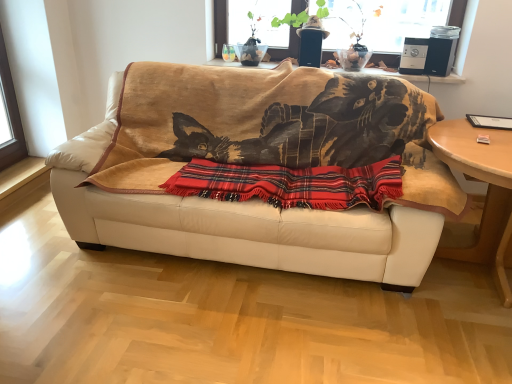
Describe the element at coordinates (420, 77) in the screenshot. This screenshot has height=384, width=512. I see `smooth glass window sill at upper center` at that location.

In the scene shown: In order to face red plaid blanket at center, should I rotate leftwards or rightwards?

You should look right and rotate roughly 3.926 degrees.

Image resolution: width=512 pixels, height=384 pixels. In order to click on smooth glass window sill at upper center in this screenshot , I will do `click(420, 77)`.

How much distance is there between red plaid blanket at center and smooth glass window sill at upper center?

They are 34.09 inches apart.

Considering the points (362, 201) and (268, 64), which point is behind, point (362, 201) or point (268, 64)?

The point (268, 64) is farther from the camera.

Consider the image. Considering the positions of objects red plaid blanket at center and smooth glass window sill at upper center in the image provided, who is more to the right, red plaid blanket at center or smooth glass window sill at upper center?

smooth glass window sill at upper center.

Between leather couch at center and smooth glass window sill at upper center, which one has larger size?

Bigger between the two is leather couch at center.

Are leather couch at center and smooth glass window sill at upper center beside each other?

There is a gap between leather couch at center and smooth glass window sill at upper center.

Can you confirm if leather couch at center is taller than smooth glass window sill at upper center?

Yes, leather couch at center is taller than smooth glass window sill at upper center.

Considering the relative positions of leather couch at center and smooth glass window sill at upper center in the image provided, is leather couch at center to the left of smooth glass window sill at upper center from the viewer's perspective?

Correct, you'll find leather couch at center to the left of smooth glass window sill at upper center.

What's the angular difference between smooth glass window sill at upper center and red plaid blanket at center's facing directions?

smooth glass window sill at upper center and red plaid blanket at center are facing 1.1 degrees away from each other.

In the scene shown: Is smooth glass window sill at upper center facing towards red plaid blanket at center?

No, smooth glass window sill at upper center is not oriented towards red plaid blanket at center.

From the picture: In terms of height, does smooth glass window sill at upper center look taller or shorter compared to red plaid blanket at center?

Clearly, smooth glass window sill at upper center is shorter compared to red plaid blanket at center.

Is smooth glass window sill at upper center closer to the viewer compared to red plaid blanket at center?

No, smooth glass window sill at upper center is further to the viewer.

Which of these two, wooden round table at right or smooth glass window sill at upper center, stands taller?

With more height is wooden round table at right.

Is wooden round table at right directly adjacent to smooth glass window sill at upper center?

No.

How many degrees apart are the facing directions of wooden round table at right and smooth glass window sill at upper center?

The angular difference between wooden round table at right and smooth glass window sill at upper center is 0.106 degrees.

From the picture: Can you confirm if wooden round table at right is wider than smooth glass window sill at upper center?

Yes, wooden round table at right is wider than smooth glass window sill at upper center.

How many degrees apart are the facing directions of leather couch at center and wooden round table at right?

0.717 degrees.

Where is `studio couch above the wooden round table at right (from a real-world perspective)`? The image size is (512, 384). studio couch above the wooden round table at right (from a real-world perspective) is located at coordinates (280, 161).

From a real-world perspective, which is physically below, leather couch at center or wooden round table at right?

wooden round table at right is physically lower.

Looking at this image, from the image's perspective, is leather couch at center on top of wooden round table at right?

Indeed, from the image's perspective, leather couch at center is shown above wooden round table at right.

Are red plaid blanket at center and leather couch at center far apart?

No, there isn't a large distance between red plaid blanket at center and leather couch at center.

From their relative heights in the image, would you say red plaid blanket at center is taller or shorter than leather couch at center?

Clearly, red plaid blanket at center is shorter compared to leather couch at center.

Between point (297, 206) and point (410, 150), which one is positioned in front?

The point (297, 206) is in front.

Which object is positioned more to the left, red plaid blanket at center or leather couch at center?

→ Positioned to the left is leather couch at center.

Considering the sizes of objects wooden round table at right and leather couch at center in the image provided, who is wider, wooden round table at right or leather couch at center?

wooden round table at right is wider.

Does wooden round table at right have a lesser height compared to leather couch at center?

Indeed, wooden round table at right has a lesser height compared to leather couch at center.

Which is closer, (x=493, y=260) or (x=320, y=150)?

The point (x=320, y=150) is more forward.

How many degrees apart are the facing directions of wooden round table at right and leather couch at center?

The angular difference between wooden round table at right and leather couch at center is 0.717 degrees.

The width and height of the screenshot is (512, 384). I want to click on window sill lying behind the red plaid blanket at center, so click(420, 77).

At what (x,y) coordinates should I click in order to perform the action: click on studio couch on the left of smooth glass window sill at upper center. Please return your answer as a coordinate pair (x, y). The width and height of the screenshot is (512, 384). Looking at the image, I should click on (280, 161).

Which object lies further to the anchor point smooth glass window sill at upper center, leather couch at center or wooden round table at right?

Based on the image, wooden round table at right appears to be further to smooth glass window sill at upper center.

Looking at the image, which one is located further to leather couch at center, smooth glass window sill at upper center or wooden round table at right?

The object further to leather couch at center is wooden round table at right.

From the image, which object appears to be farther from red plaid blanket at center, smooth glass window sill at upper center or leather couch at center?

smooth glass window sill at upper center is positioned further to the anchor red plaid blanket at center.

Based on the photo, considering their positions, is red plaid blanket at center positioned closer to wooden round table at right than leather couch at center?

red plaid blanket at center.

Estimate the real-world distances between objects in this image. Which object is closer to smooth glass window sill at upper center, red plaid blanket at center or leather couch at center?

leather couch at center is closer to smooth glass window sill at upper center.

From the image, which object appears to be nearer to red plaid blanket at center, wooden round table at right or leather couch at center?

Among the two, leather couch at center is located nearer to red plaid blanket at center.

Looking at the image, which one is located closer to red plaid blanket at center, wooden round table at right or smooth glass window sill at upper center?

Based on the image, wooden round table at right appears to be nearer to red plaid blanket at center.

Which object lies further to the anchor point smooth glass window sill at upper center, wooden round table at right or leather couch at center?

Among the two, wooden round table at right is located further to smooth glass window sill at upper center.

In order to click on window sill between red plaid blanket at center and wooden round table at right in the horizontal direction in this screenshot , I will do `click(420, 77)`.

I want to click on plaid between leather couch at center and smooth glass window sill at upper center from front to back, so click(290, 184).

What are the coordinates of `plaid between leather couch at center and wooden round table at right from left to right` in the screenshot? It's located at (290, 184).

At what (x,y) coordinates should I click in order to perform the action: click on window sill located between leather couch at center and wooden round table at right in the left-right direction. Please return your answer as a coordinate pair (x, y). Looking at the image, I should click on (420, 77).